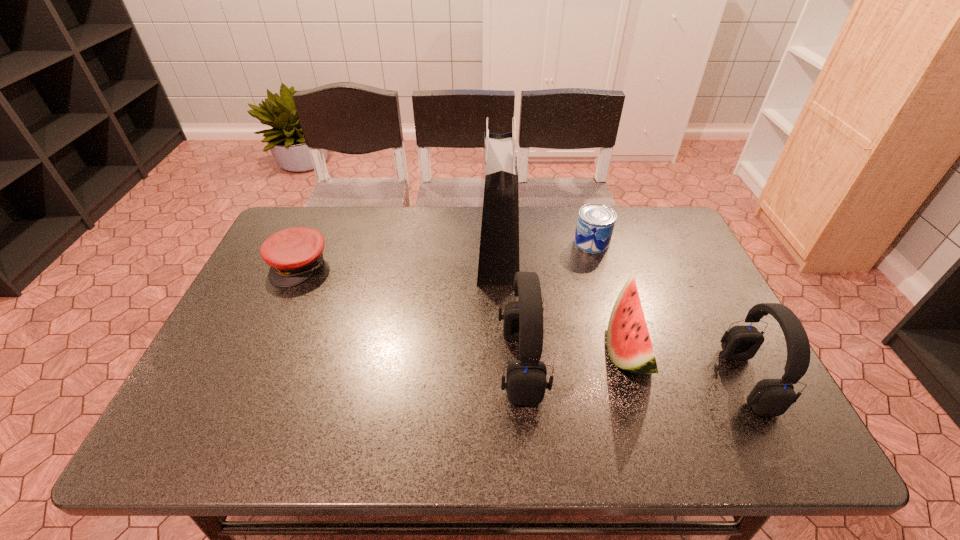
Locate an element on the screen. vacant region at the far edge of the desktop is located at coordinates (357, 245).

Locate an element on the screen. Image resolution: width=960 pixels, height=540 pixels. free space at the near edge of the desktop is located at coordinates (488, 406).

Where is `vacant space at the left edge of the desktop`? vacant space at the left edge of the desktop is located at coordinates (249, 365).

The image size is (960, 540). Identify the location of vacant space at the far left corner of the desktop. (312, 221).

The height and width of the screenshot is (540, 960). What are the coordinates of `vacant space at the far right corner of the desktop` in the screenshot? It's located at (667, 245).

The image size is (960, 540). In order to click on free space between the fourth tallest object and the shopping bag in this screenshot , I will do `click(563, 301)`.

Where is `blank region between the watermelon and the shortest object`? The image size is (960, 540). blank region between the watermelon and the shortest object is located at coordinates (464, 307).

Where is `free space between the shopping bag and the cap`? This screenshot has height=540, width=960. free space between the shopping bag and the cap is located at coordinates (398, 260).

Find the location of a particular element. This screenshot has width=960, height=540. vacant space that's between the third shortest object and the second shortest object is located at coordinates (610, 295).

I want to click on vacant space in between the cap and the can, so click(445, 254).